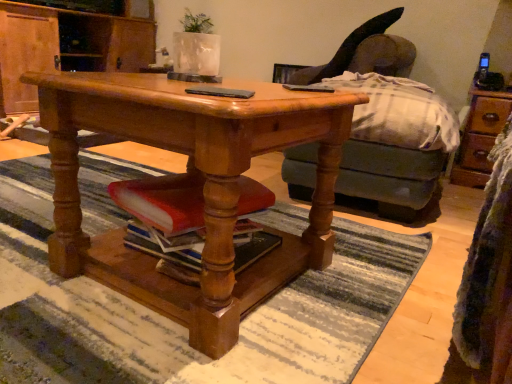
Question: From a real-world perspective, is velvet dark gray swivel chair at upper right beneath black matte phone at center?

Choices:
 (A) no
 (B) yes

Answer: (A)

Question: Could you tell me if velvet dark gray swivel chair at upper right is turned towards black matte phone at center?

Choices:
 (A) yes
 (B) no

Answer: (B)

Question: Is velvet dark gray swivel chair at upper right facing away from black matte phone at center?

Choices:
 (A) no
 (B) yes

Answer: (A)

Question: Does velvet dark gray swivel chair at upper right have a larger size compared to black matte phone at center?

Choices:
 (A) yes
 (B) no

Answer: (A)

Question: Can you confirm if velvet dark gray swivel chair at upper right is taller than black matte phone at center?

Choices:
 (A) yes
 (B) no

Answer: (A)

Question: Is velvet dark gray swivel chair at upper right in front of black matte phone at center?

Choices:
 (A) yes
 (B) no

Answer: (B)

Question: Can you confirm if wooden cabinet at center is shorter than black matte phone at center?

Choices:
 (A) yes
 (B) no

Answer: (B)

Question: From the image's perspective, is wooden cabinet at center above black matte phone at center?

Choices:
 (A) yes
 (B) no

Answer: (A)

Question: Considering the relative positions of wooden cabinet at center and black matte phone at center in the image provided, is wooden cabinet at center behind black matte phone at center?

Choices:
 (A) yes
 (B) no

Answer: (A)

Question: From a real-world perspective, is wooden cabinet at center physically below black matte phone at center?

Choices:
 (A) no
 (B) yes

Answer: (B)

Question: Is black matte phone at center a part of wooden cabinet at center?

Choices:
 (A) yes
 (B) no

Answer: (B)

Question: Does wooden cabinet at center have a lesser width compared to black matte phone at center?

Choices:
 (A) no
 (B) yes

Answer: (A)

Question: Is white textured vase at upper center not within polished wood desk at center?

Choices:
 (A) no
 (B) yes

Answer: (B)